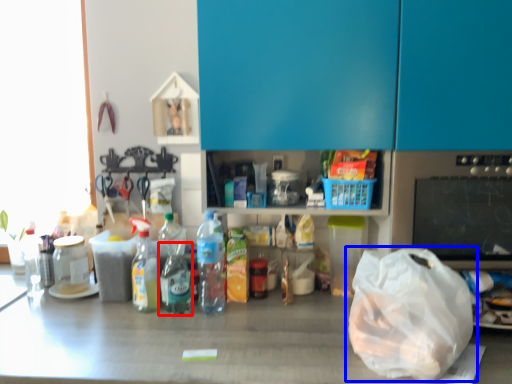
Question: Which object appears farthest to the camera in this image, bottle (highlighted by a red box) or plastic bag (highlighted by a blue box)?

Choices:
 (A) bottle
 (B) plastic bag

Answer: (A)